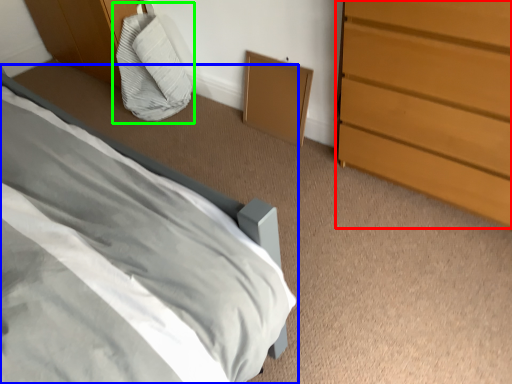
Question: Based on their relative distances, which object is farther from chest of drawers (highlighted by a red box)? Choose from bed (highlighted by a blue box) and bean bag chair (highlighted by a green box).

Choices:
 (A) bed
 (B) bean bag chair

Answer: (B)